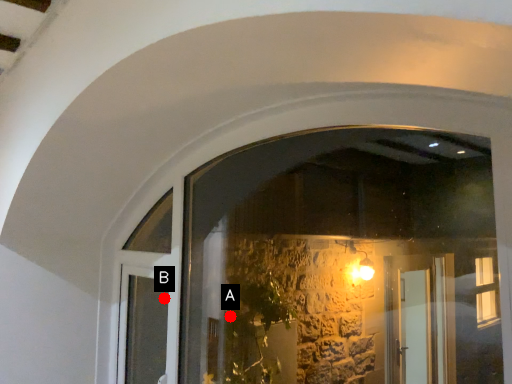
Question: Two points are circled on the image, labeled by A and B beside each circle. Among these points, which one is farthest from the camera?

Choices:
 (A) A is further
 (B) B is further

Answer: (A)